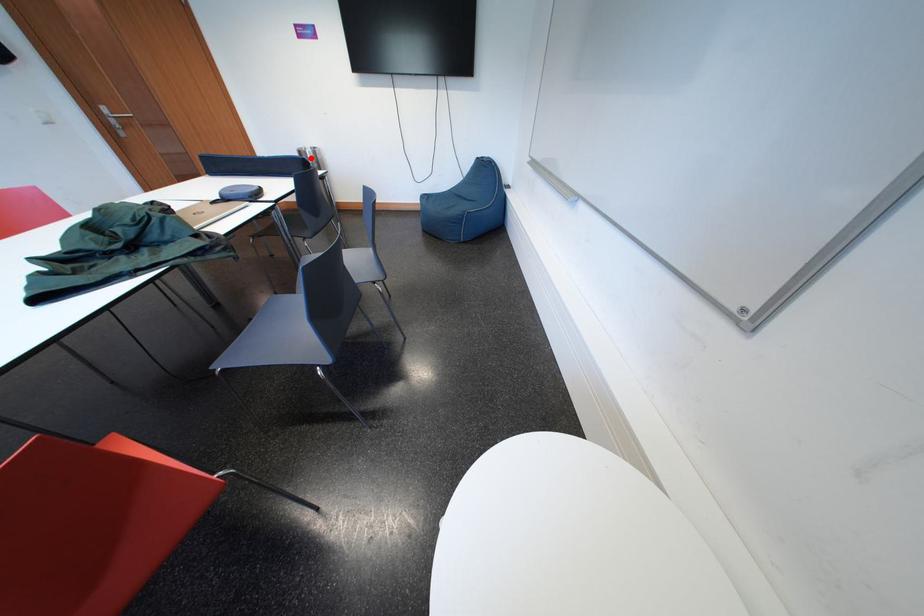
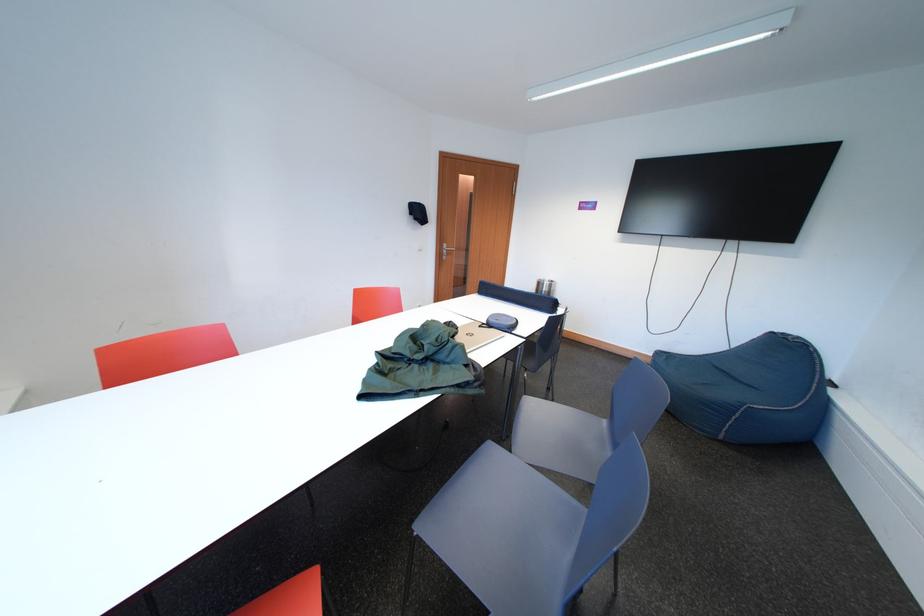
Where in the second image is the point corresponding to the highlighted location from the first image?

(549, 288)